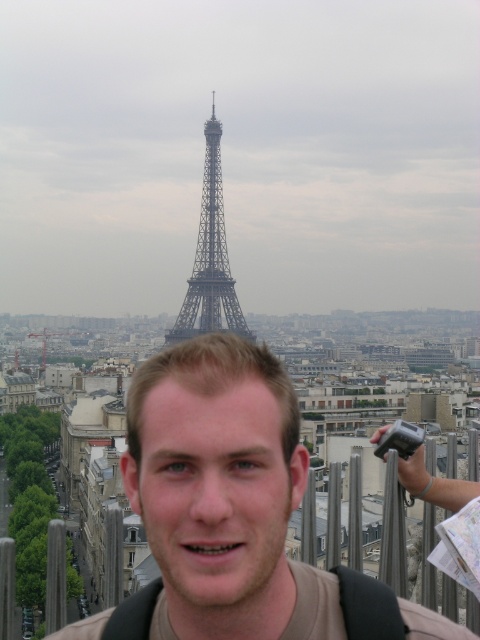
Question: Does brown matte shirt at center appear under metallic silver tower at center?

Choices:
 (A) no
 (B) yes

Answer: (B)

Question: Is brown matte shirt at center smaller than metallic silver tower at center?

Choices:
 (A) yes
 (B) no

Answer: (B)

Question: Is brown matte shirt at center thinner than metallic silver tower at center?

Choices:
 (A) yes
 (B) no

Answer: (B)

Question: Which of the following is the closest to the observer?

Choices:
 (A) [x=213, y=305]
 (B) [x=256, y=552]

Answer: (B)